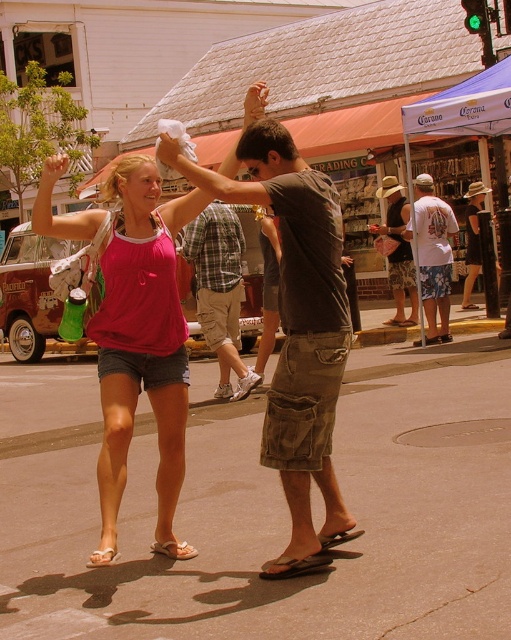
You are a photographer standing at the back of the scene. You want to capture a photo that includes both the brown cotton shirt at center and the white fabric sandal at lower center without any part of them being cut off. Given that your camera has a fixed focal length and you can only move forward or backward, what is the minimum distance you need to be from the scene to ensure both objects are fully visible?

The brown cotton shirt at center and white fabric sandal at lower center are 4.19 feet apart from each other. To ensure both are fully visible in the photo, the photographer must position themselves far enough back so that the camera can capture the entire 4.19 feet distance between them. The exact minimum distance depends on the camera sensor size and lens focal length, but generally, maintaining a distance of at least 4.19 feet from the closest object plus the camera lens focal length would ensure both is